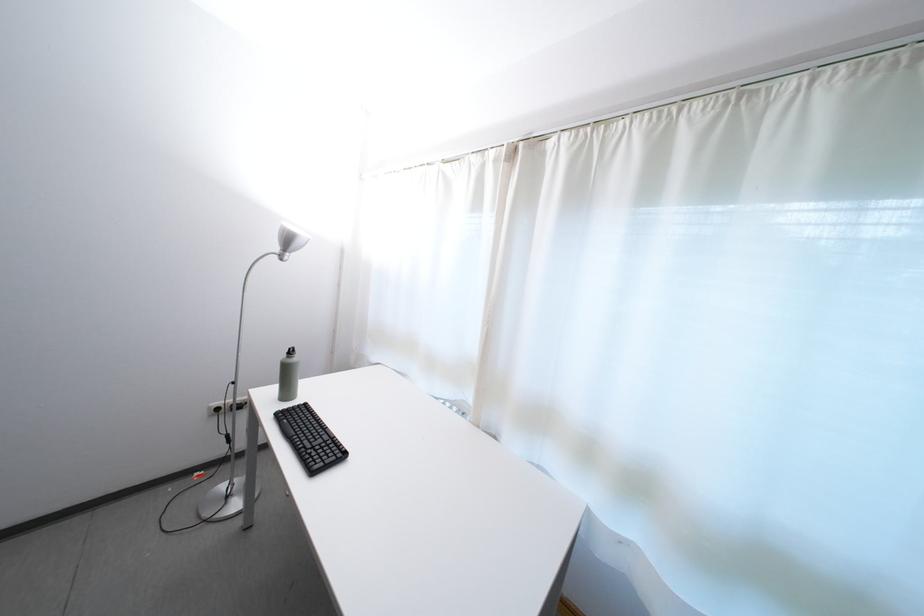
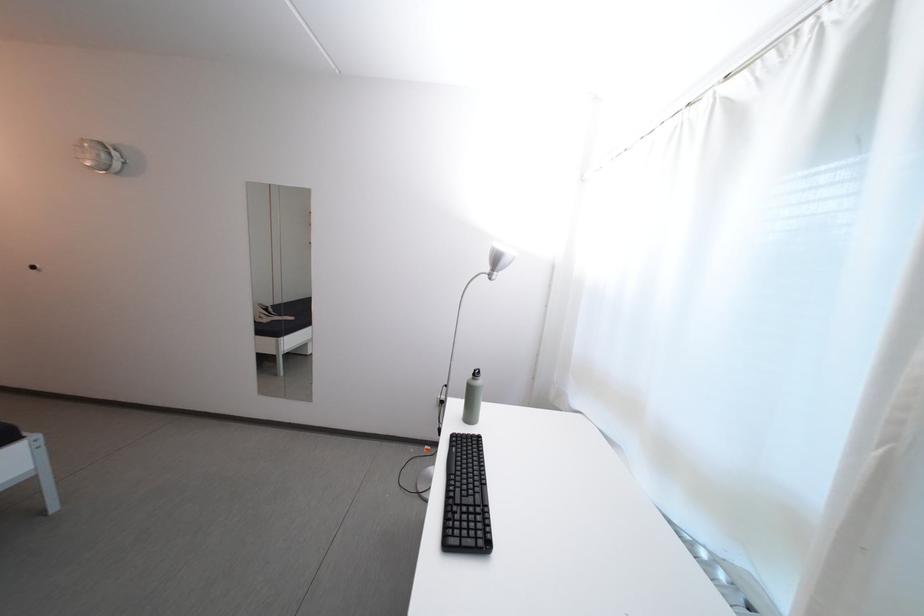
Question: Based on the continuous images, in which direction is the camera rotating? Reply with the corresponding letter.

Choices:
 (A) Left
 (B) Right
 (C) Up
 (D) Down

Answer: (A)